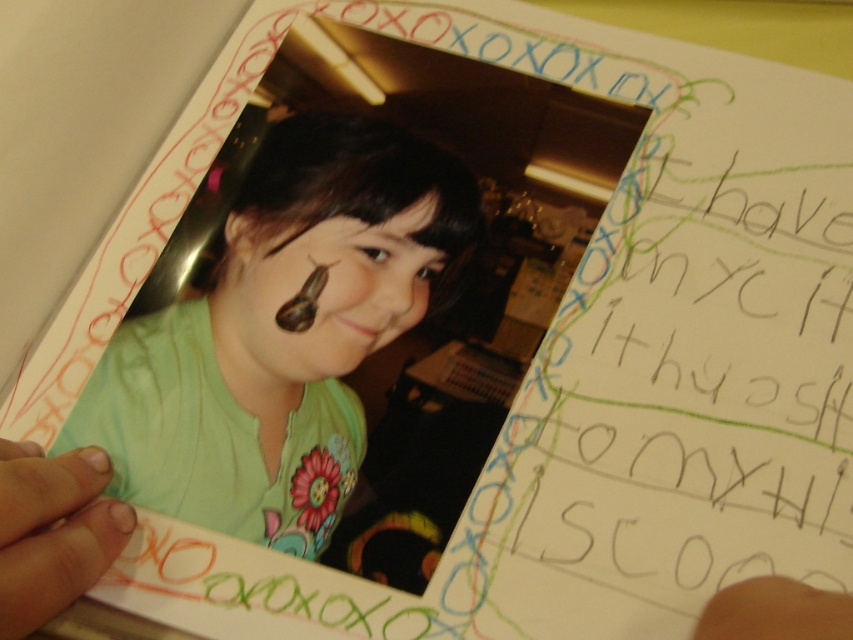
Consider the image. Who is more distant from viewer, (x=376, y=205) or (x=409, y=252)?

The point (x=376, y=205) is behind.

Is green matte shirt at center smaller than brown shiny snail at center?

No, green matte shirt at center is not smaller than brown shiny snail at center.

Is point (202, 422) farther from camera compared to point (405, 291)?

No, it is in front of (405, 291).

This screenshot has width=853, height=640. I want to click on green matte shirt at center, so click(x=281, y=333).